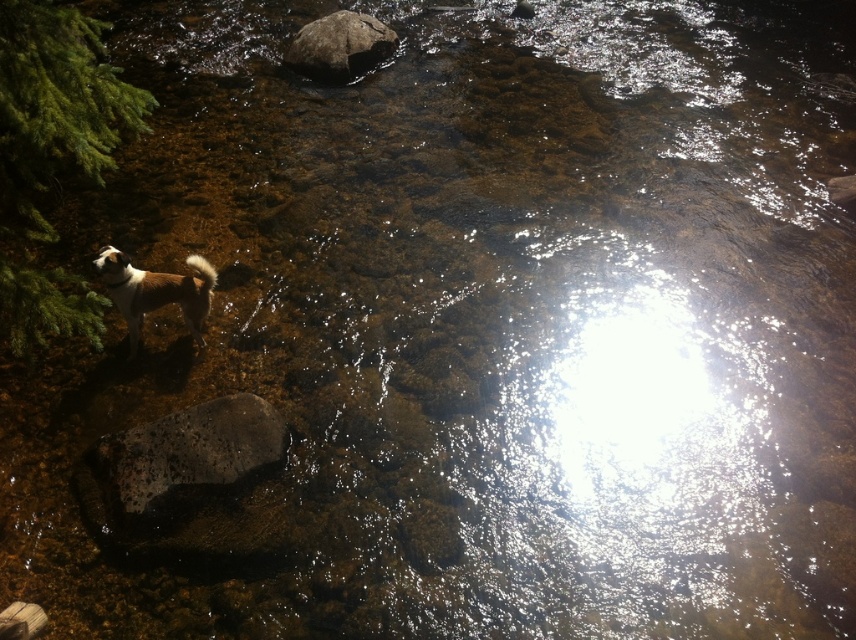
Consider the image. You are a photographer adjusting your camera settings to focus on two points in the scene. The first point is point (173, 454) and the second is point (372, 44). Which point should you focus on first to ensure the closest object is sharp?

You should focus on point (173, 454) first because it is closer to the camera than point (372, 44), ensuring the closest object is in sharp focus.

You are a photographer trying to capture a photo of the brown fur dog at left and the speckled gray rock at center. If your camera can focus on objects within a 30 inch range, will both subjects be in focus?

The speckled gray rock at center is 36.35 inches from the brown fur dog at left, which is beyond the 30 inch focus range. Therefore, both subjects cannot be in focus simultaneously.

You are a hiker who wants to cross the shallow rocky stream. You see a speckled gray rock at center and a smooth gray rock at upper center. Which rock is shorter?

The speckled gray rock at center is not as tall as the smooth gray rock at upper center, so the speckled gray rock at center is shorter.